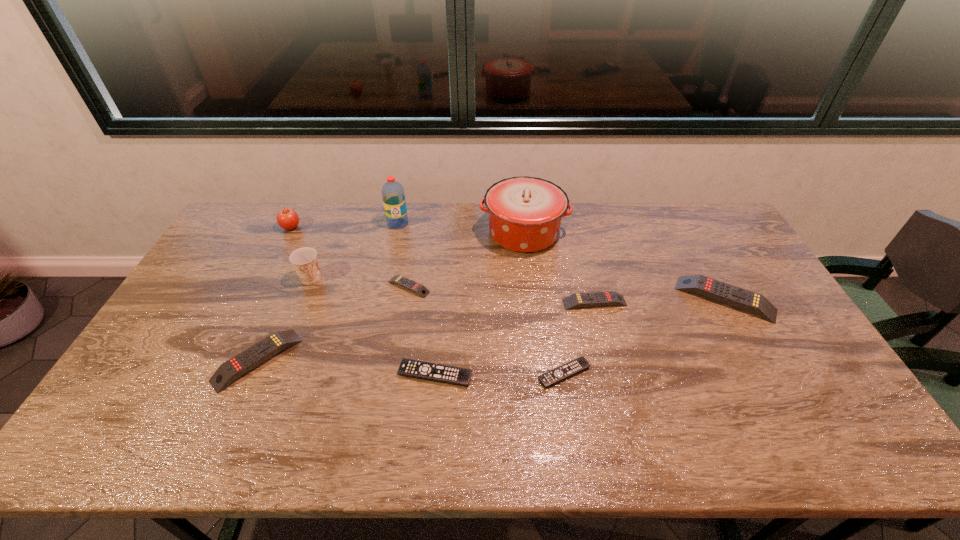
In the image, there is a desktop. At what (x,y) coordinates should I click in order to perform the action: click on vacant space at the left edge. Please return your answer as a coordinate pair (x, y). Looking at the image, I should click on (218, 273).

The height and width of the screenshot is (540, 960). I want to click on vacant region at the right edge of the desktop, so click(701, 256).

Locate an element on the screen. This screenshot has width=960, height=540. vacant space at the far left corner is located at coordinates (254, 221).

I want to click on free space at the near left corner of the desktop, so click(167, 426).

In the image, there is a desktop. Identify the location of free region at the far right corner. The height and width of the screenshot is (540, 960). coord(721,229).

This screenshot has height=540, width=960. What are the coordinates of `free point between the left black remote control and the orange casserole` in the screenshot? It's located at (479, 303).

Find the location of a particular element. This screenshot has width=960, height=540. vacant region between the left black remote control and the smaller black remote control is located at coordinates (499, 374).

This screenshot has width=960, height=540. I want to click on free space between the casserole and the third yellow remote control from left to right, so click(559, 268).

Locate an element on the screen. The image size is (960, 540). unoccupied area between the second yellow remote control from left to right and the casserole is located at coordinates (467, 260).

Where is `blank region between the orange casserole and the shortest remote control`? blank region between the orange casserole and the shortest remote control is located at coordinates (544, 303).